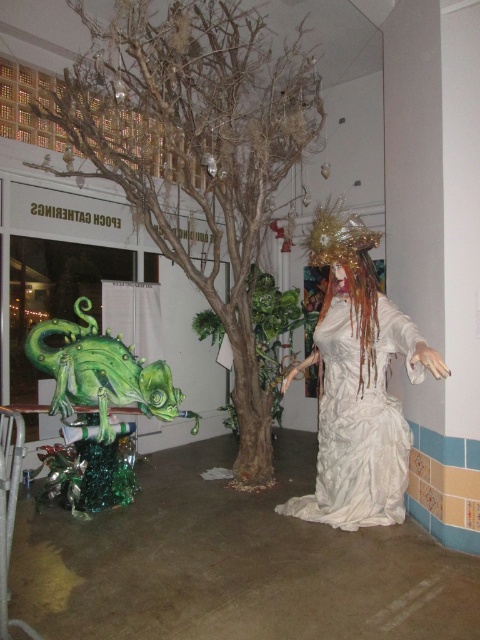
Question: Which is farther from the green metallic tree at center?

Choices:
 (A) white textured dress at center
 (B) green glossy dragon at lower left

Answer: (A)

Question: Is green metallic tree at center smaller than green glossy dragon at lower left?

Choices:
 (A) yes
 (B) no

Answer: (B)

Question: Which object appears farthest from the camera in this image?

Choices:
 (A) green metallic tree at center
 (B) green glossy dragon at lower left
 (C) white textured dress at center

Answer: (B)

Question: Can you confirm if green metallic tree at center is positioned below white textured dress at center?

Choices:
 (A) no
 (B) yes

Answer: (A)

Question: Does green metallic tree at center appear under green glossy dragon at lower left?

Choices:
 (A) no
 (B) yes

Answer: (A)

Question: Among these points, which one is nearest to the camera?

Choices:
 (A) (31, 344)
 (B) (187, 16)
 (C) (334, 392)

Answer: (C)